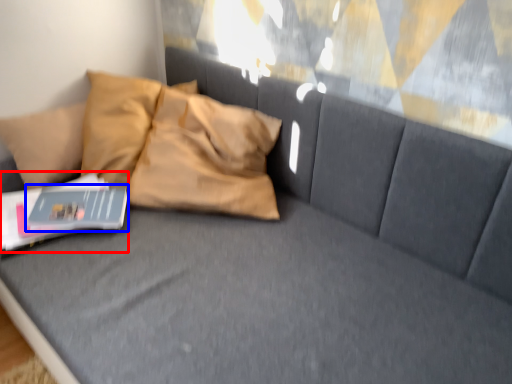
Question: Which point is closer to the camera, paperback book (highlighted by a red box) or magazine (highlighted by a blue box)?

Choices:
 (A) paperback book
 (B) magazine

Answer: (A)